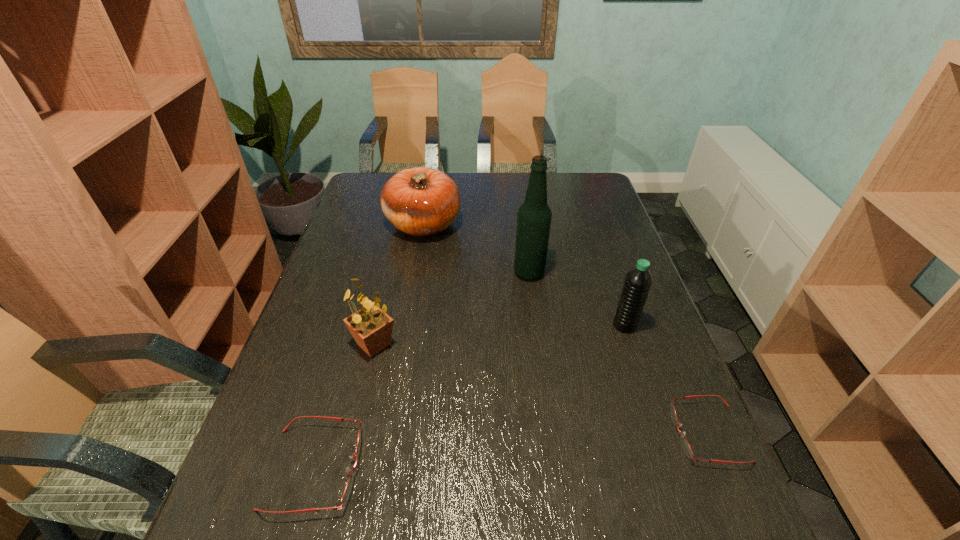
Identify the location of free space at the near right corner. (702, 458).

The height and width of the screenshot is (540, 960). Identify the location of free point between the shortest object and the sunflower. (541, 389).

Identify the location of vacant space that is in between the tallest object and the sunflower. (451, 308).

At what (x,y) coordinates should I click in order to perform the action: click on vacant area between the shortest object and the fifth nearest object. Please return your answer as a coordinate pair (x, y). The width and height of the screenshot is (960, 540). Looking at the image, I should click on (618, 353).

Where is `unoccupied position between the second farthest object and the left spectacles`? unoccupied position between the second farthest object and the left spectacles is located at coordinates (421, 370).

This screenshot has width=960, height=540. Find the location of `free space that is in between the sunflower and the taller spectacles`. free space that is in between the sunflower and the taller spectacles is located at coordinates point(345,407).

Where is `free space that is in between the water bottle and the second shortest object`? The image size is (960, 540). free space that is in between the water bottle and the second shortest object is located at coordinates (469, 397).

What are the coordinates of `free space between the water bottle and the right spectacles` in the screenshot? It's located at (666, 379).

Where is `blank region between the pumpkin and the sunflower`? This screenshot has width=960, height=540. blank region between the pumpkin and the sunflower is located at coordinates (398, 284).

Where is `the fifth closest object to the pumpkin`? This screenshot has height=540, width=960. the fifth closest object to the pumpkin is located at coordinates (686, 447).